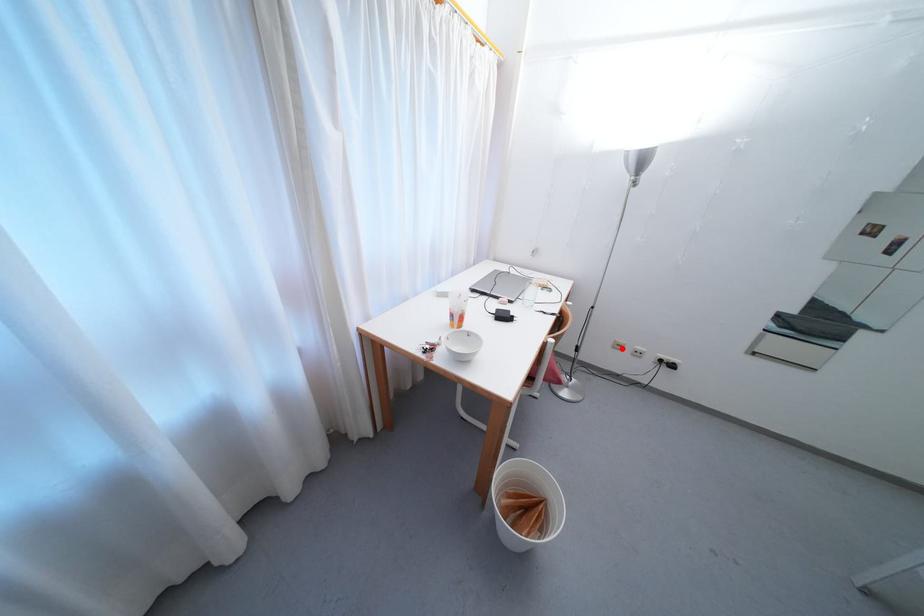
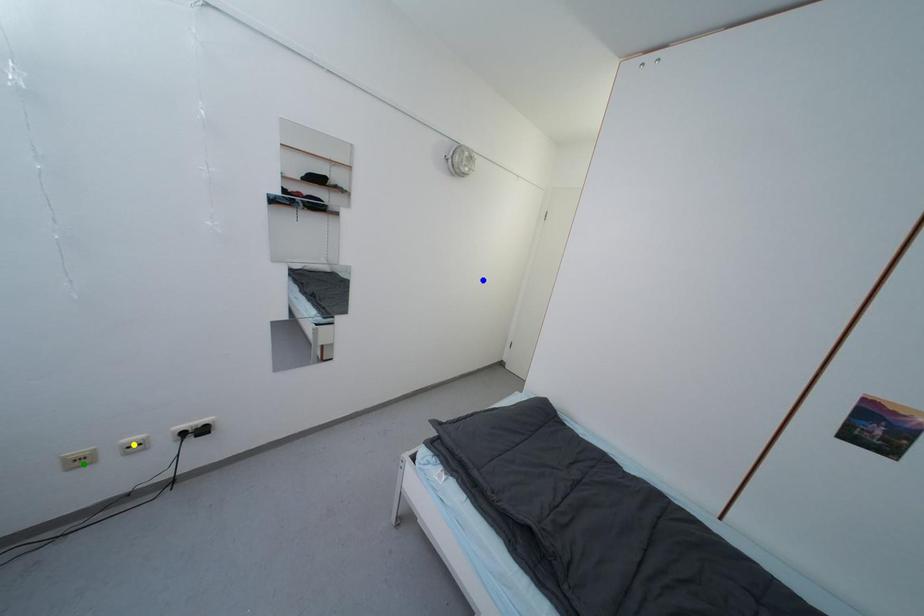
Question: I am providing you with two images of the same scene from different viewpoints. A red point is marked on the first image. You are given multiple points on the second image. In image 2, which mark is for the same physical point as the one in image 1?

Choices:
 (A) green point
 (B) blue point
 (C) yellow point

Answer: (A)